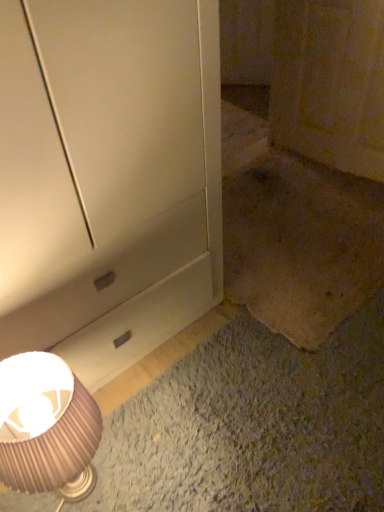
Measure the distance between point (48, 433) and camera.

They are 32.99 inches apart.

Locate an element on the screen. The height and width of the screenshot is (512, 384). brown pleated lampshade at lower left is located at coordinates (48, 428).

What do you see at coordinates (48, 428) in the screenshot? This screenshot has width=384, height=512. I see `brown pleated lampshade at lower left` at bounding box center [48, 428].

In order to face brown pleated lampshade at lower left, should I rotate leftwards or rightwards?

You should look left and rotate roughly 18.028 degrees.

The image size is (384, 512). What are the coordinates of `brown pleated lampshade at lower left` in the screenshot? It's located at [48, 428].